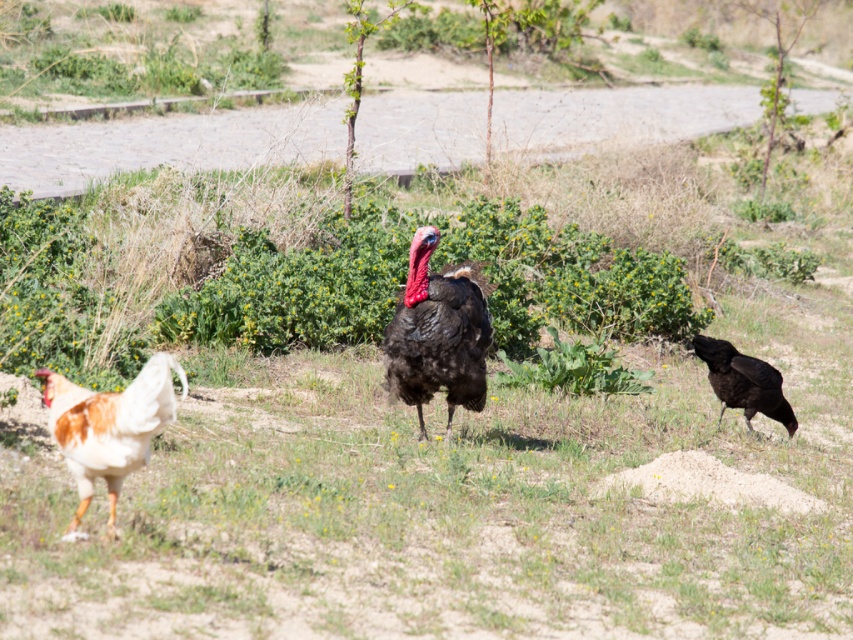
Question: Which object is the farthest from the shiny black turkey at right?

Choices:
 (A) brown feathered chicken at left
 (B) shiny dark feathers turkey at center

Answer: (A)

Question: Among these points, which one is nearest to the camera?

Choices:
 (A) (425, 289)
 (B) (747, 396)

Answer: (A)

Question: Can you confirm if shiny dark feathers turkey at center is positioned to the right of shiny black turkey at right?

Choices:
 (A) no
 (B) yes

Answer: (A)

Question: Is the position of brown feathered chicken at left more distant than that of shiny black turkey at right?

Choices:
 (A) no
 (B) yes

Answer: (A)

Question: Which of the following is the closest to the observer?

Choices:
 (A) brown feathered chicken at left
 (B) shiny dark feathers turkey at center
 (C) shiny black turkey at right

Answer: (A)

Question: In this image, where is brown feathered chicken at left located relative to shiny black turkey at right?

Choices:
 (A) left
 (B) right

Answer: (A)